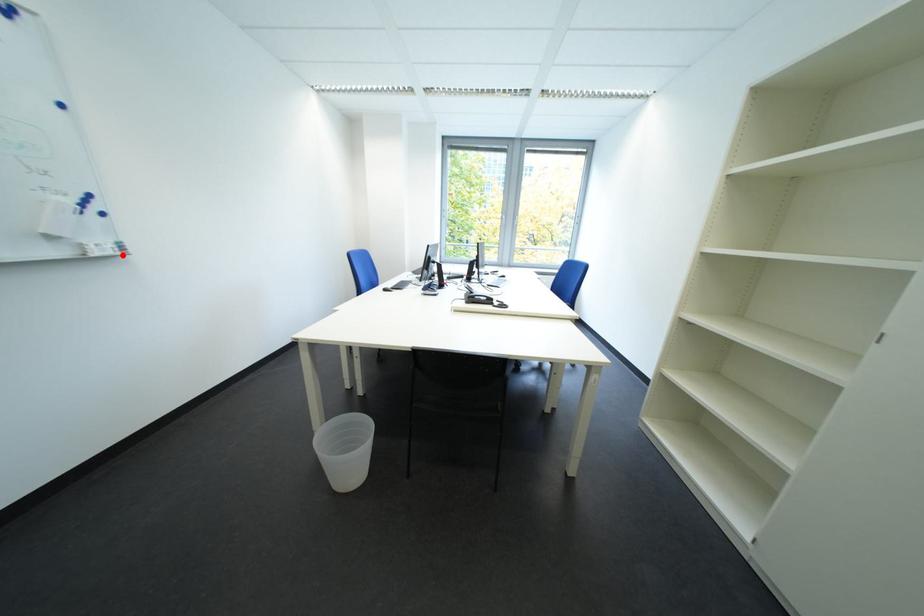
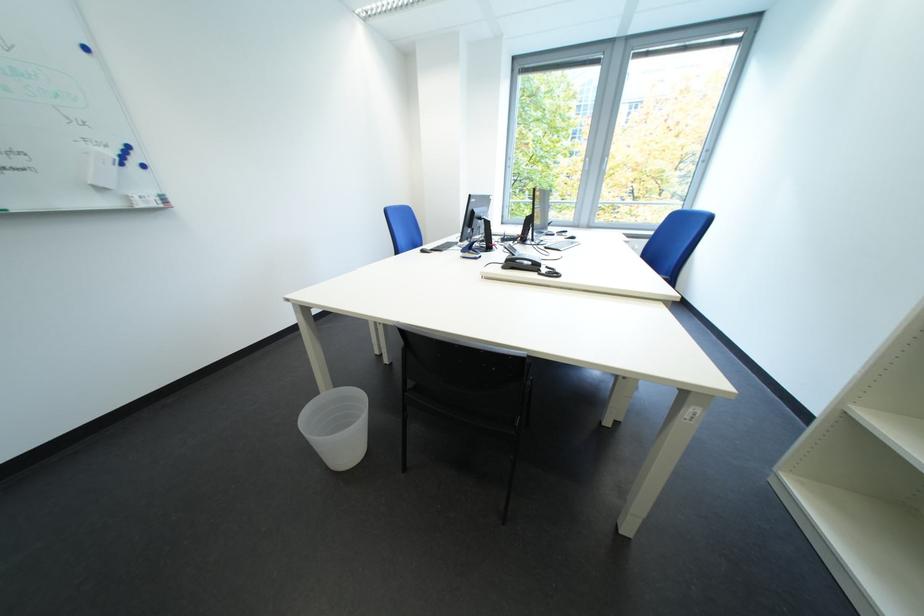
Find the pixel in the second image that matches the highlighted location in the first image.

(165, 208)